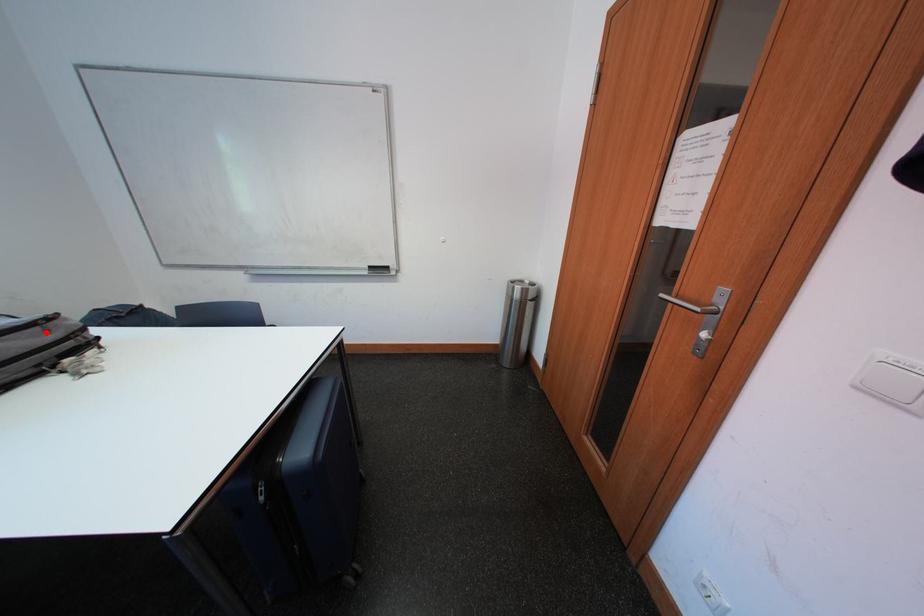
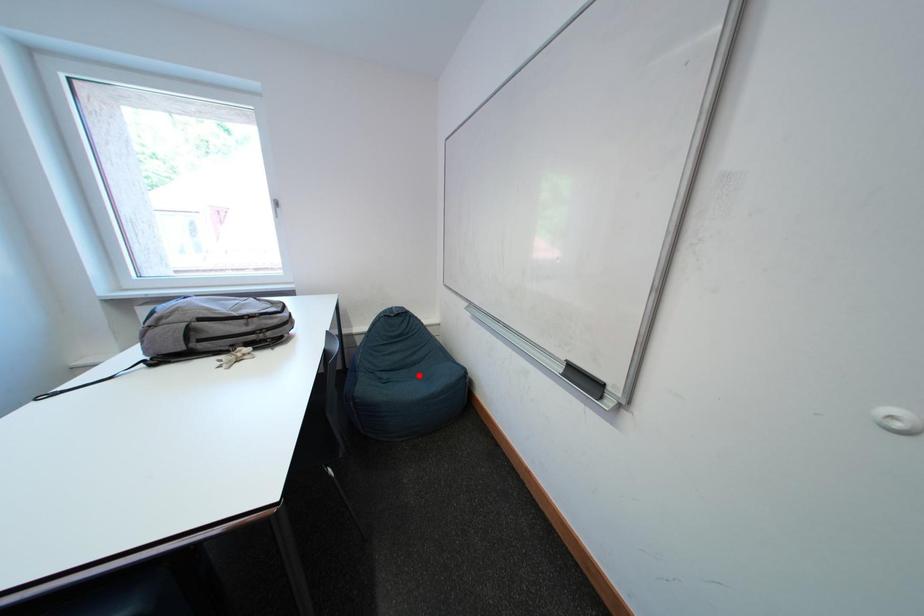
I am providing you with two images of the same scene from different viewpoints. A red point is marked on the first image and another point is marked on the second image. Does the point marked in image1 correspond to the same location as the one in image2?

No